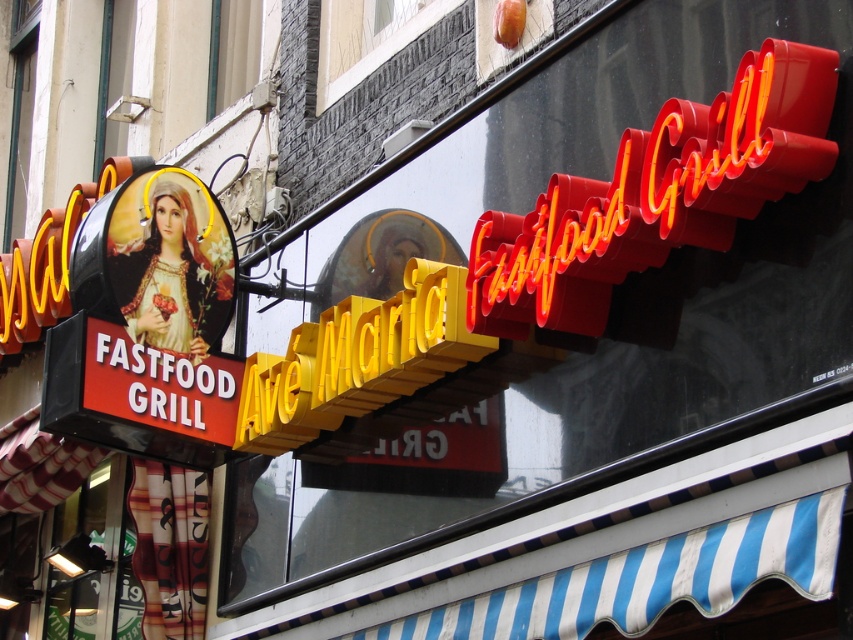
You are standing in front of the Ave Maria Fastfood Grill. You notice two signs above the entrance. The neon red sign at upper right and the yellow metallic sign at center. Which sign is closer to you?

The neon red sign at upper right is closer to the viewer than the yellow metallic sign at center.

You are a delivery person standing 3 meters away from the entrance of Ave Maria Fastfood Grill. You need to place a large package between the neon red sign at upper right and the yellow metallic sign at center. Can you fit the package there if it measures 5 meters in length?

The distance between the neon red sign at upper right and the yellow metallic sign at center is 5.01 meters. Since the package is 5 meters long, it can fit as there is enough space between them.

You are a customer entering the Ave Maria Fastfood Grill and want to read both the neon red sign at upper right and the yellow metallic sign at center. Which sign will you need to look up higher to read?

The neon red sign at upper right is located at upper right, so you need to look up higher to read the neon red sign at upper right compared to the yellow metallic sign at center.